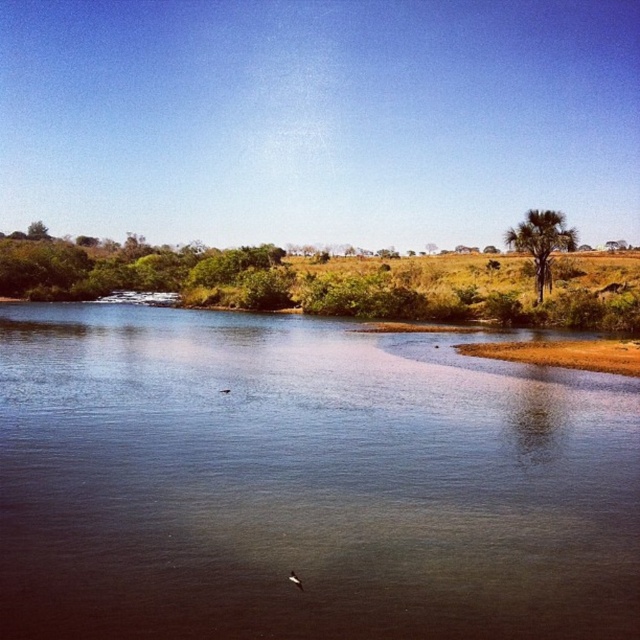
Question: Does blue smooth water at center lie in front of green leafy tree at right?

Choices:
 (A) yes
 (B) no

Answer: (A)

Question: Is green leafy tree at right bigger than white feathered bird at lower center?

Choices:
 (A) no
 (B) yes

Answer: (B)

Question: Which object is closer to the camera taking this photo?

Choices:
 (A) blue smooth water at center
 (B) green leafy tree at right
 (C) white feathered bird at lower center

Answer: (A)

Question: Which object is closer to the camera taking this photo?

Choices:
 (A) blue smooth water at center
 (B) green leafy tree at right

Answer: (A)

Question: From the image, what is the correct spatial relationship of blue smooth water at center in relation to white feathered bird at lower center?

Choices:
 (A) left
 (B) right

Answer: (B)

Question: Which object appears farthest from the camera in this image?

Choices:
 (A) white feathered bird at lower center
 (B) green leafy tree at right
 (C) blue smooth water at center

Answer: (B)